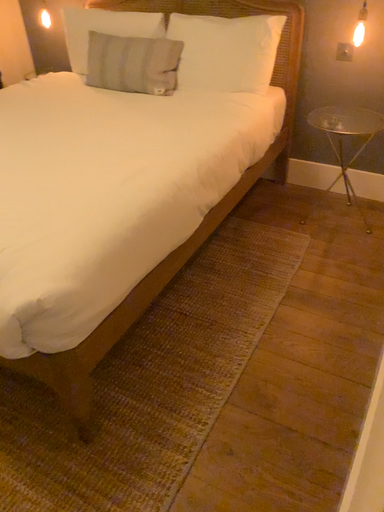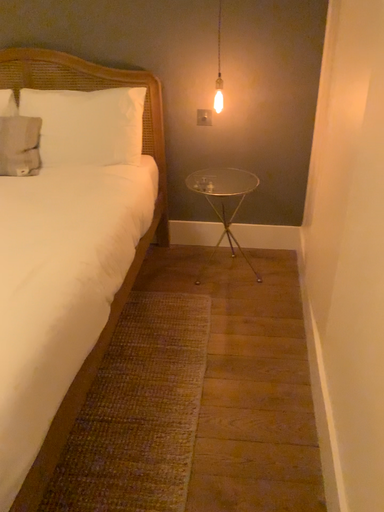
Question: How did the camera likely rotate when shooting the video?

Choices:
 (A) rotated right
 (B) rotated left

Answer: (A)